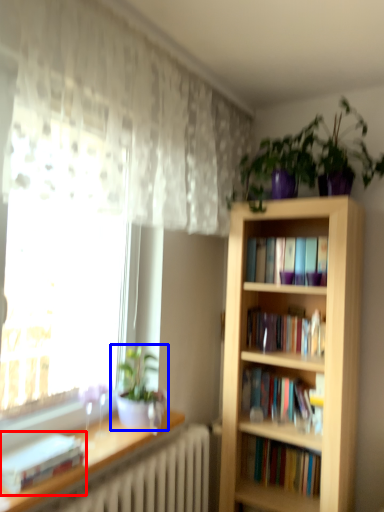
Question: Which object is closer to the camera taking this photo, book (highlighted by a red box) or houseplant (highlighted by a blue box)?

Choices:
 (A) book
 (B) houseplant

Answer: (A)